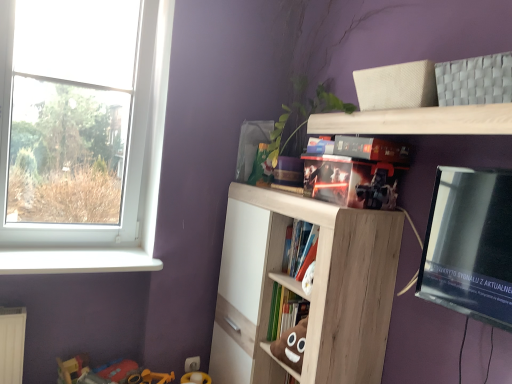
Question: In terms of size, does black glossy tv at upper right appear bigger or smaller than light wood shelf at upper center, placed as the first shelf when sorted from top to bottom?

Choices:
 (A) big
 (B) small

Answer: (A)

Question: In terms of height, does black glossy tv at upper right look taller or shorter compared to light wood shelf at upper center, the second shelf when ordered from bottom to top?

Choices:
 (A) short
 (B) tall

Answer: (B)

Question: Estimate the real-world distances between objects in this image. Which object is closer to the plastic toy at lower left?

Choices:
 (A) light wood shelf at upper center, which is the second shelf from top to bottom
 (B) hardcover book at center, which is counted as the second book, starting from the bottom
 (C) light wood shelf at upper center, placed as the first shelf when sorted from top to bottom
 (D) white plastic window sill at lower left
 (E) black glossy tv at upper right

Answer: (D)

Question: Which object is the farthest from the black glossy tv at upper right?

Choices:
 (A) matt cardboard box at upper center, acting as the first book starting from the top
 (B) brown plush toy at center, the first book when ordered from bottom to top
 (C) hardcover book at center, the second book positioned from the top
 (D) light wood shelf at upper center, which is the 1th shelf in bottom-to-top order
 (E) light wood shelf at upper center, the second shelf when ordered from bottom to top

Answer: (B)